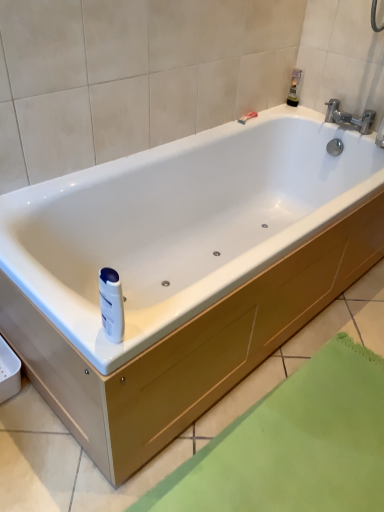
Question: In the image, is white plastic bottle at center, which is the 2th toiletry from top to bottom, positioned in front of or behind silver metallic faucet at upper right?

Choices:
 (A) behind
 (B) front

Answer: (B)

Question: Is white plastic bottle at center, acting as the 1th toiletry starting from the bottom, spatially inside silver metallic faucet at upper right, or outside of it?

Choices:
 (A) inside
 (B) outside

Answer: (B)

Question: Considering the real-world distances, which object is closest to the white plastic bottle at center, which is the 2th toiletry from right to left?

Choices:
 (A) silver metallic faucet at upper right
 (B) matte plastic razor at upper right
 (C) translucent plastic bottle at upper right, the first toiletry in the right-to-left sequence

Answer: (B)

Question: Estimate the real-world distances between objects in this image. Which object is closer to the white plastic bottle at center, the first toiletry viewed from the front?

Choices:
 (A) translucent plastic bottle at upper right, which is the 1th toiletry from back to front
 (B) matte plastic razor at upper right
 (C) silver metallic faucet at upper right

Answer: (B)